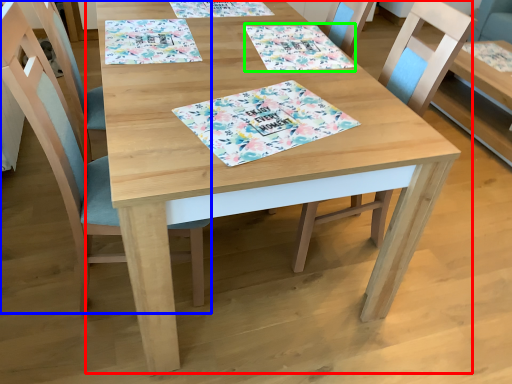
Question: Which object is the farthest from table (highlighted by a red box)? Choose among these: chair (highlighted by a blue box) or tablecloth (highlighted by a green box).

Choices:
 (A) chair
 (B) tablecloth

Answer: (A)